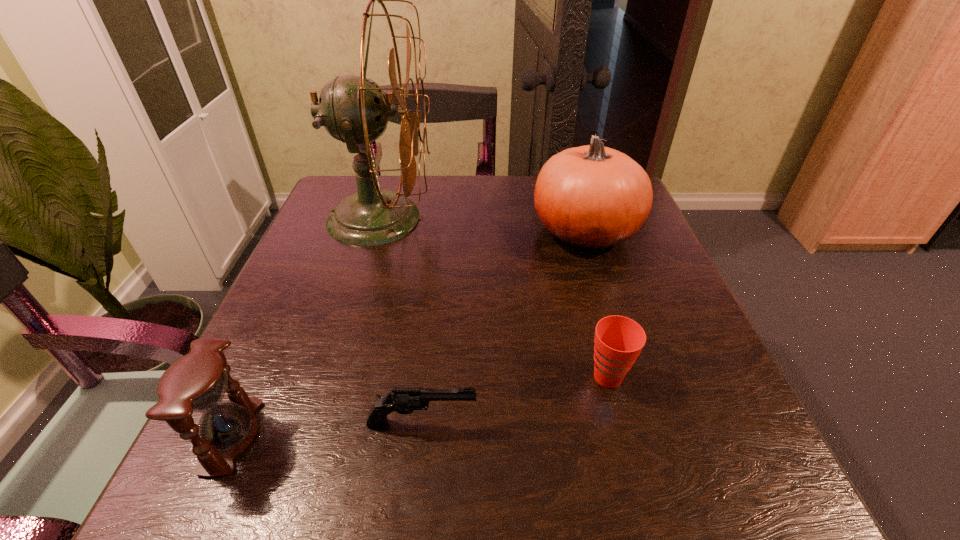
Locate an element on the screen. The image size is (960, 540). vacant space located at the end of the barrel of the shortest object is located at coordinates (709, 423).

Find the location of `fan positioned at the far edge`. fan positioned at the far edge is located at coordinates (353, 109).

In order to click on pumpkin that is positioned at the far edge in this screenshot , I will do pos(591,197).

The image size is (960, 540). I want to click on object located at the near edge, so click(196, 383).

At what (x,y) coordinates should I click in order to perform the action: click on fan that is positioned at the left edge. Please return your answer as a coordinate pair (x, y). Image resolution: width=960 pixels, height=540 pixels. Looking at the image, I should click on (353, 109).

This screenshot has width=960, height=540. I want to click on hourglass present at the left edge, so click(x=196, y=383).

Identify the location of pumpkin present at the right edge. (591, 197).

The height and width of the screenshot is (540, 960). Find the location of `cup that is positioned at the right edge`. cup that is positioned at the right edge is located at coordinates (619, 340).

What are the coordinates of `object that is at the far left corner` in the screenshot? It's located at (353, 109).

The height and width of the screenshot is (540, 960). I want to click on object situated at the near left corner, so click(x=196, y=383).